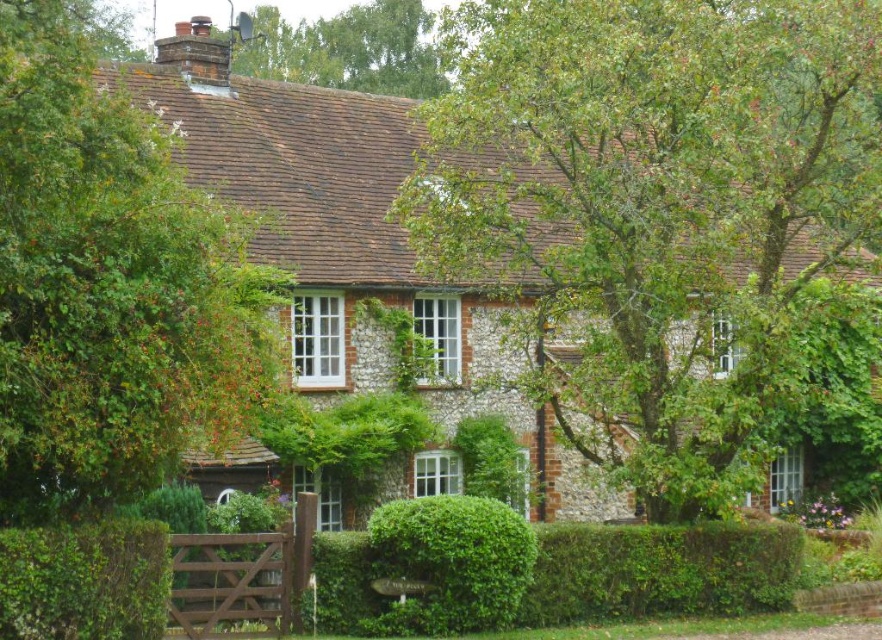
Question: Which of the following is the closest to the observer?

Choices:
 (A) green leafy tree at upper center
 (B) green leafy tree at left
 (C) green leafy hedge at center

Answer: (B)

Question: Estimate the real-world distances between objects in this image. Which object is farther from the green leafy hedge at lower right?

Choices:
 (A) green leafy tree at left
 (B) green leafy tree at upper center
 (C) green leafy hedge at center

Answer: (B)

Question: Can you confirm if green leafy hedge at center is wider than green leafy tree at upper center?

Choices:
 (A) no
 (B) yes

Answer: (A)

Question: Can you confirm if green leafy hedge at lower right is thinner than green leafy hedge at lower left?

Choices:
 (A) no
 (B) yes

Answer: (B)

Question: In this image, where is green leafy hedge at lower left located relative to green leafy tree at upper center?

Choices:
 (A) above
 (B) below

Answer: (B)

Question: Considering the real-world distances, which object is farthest from the green leafy hedge at center?

Choices:
 (A) green leafy hedge at lower left
 (B) green leafy tree at left
 (C) green leafy hedge at lower right
 (D) green leafy tree at upper center

Answer: (D)